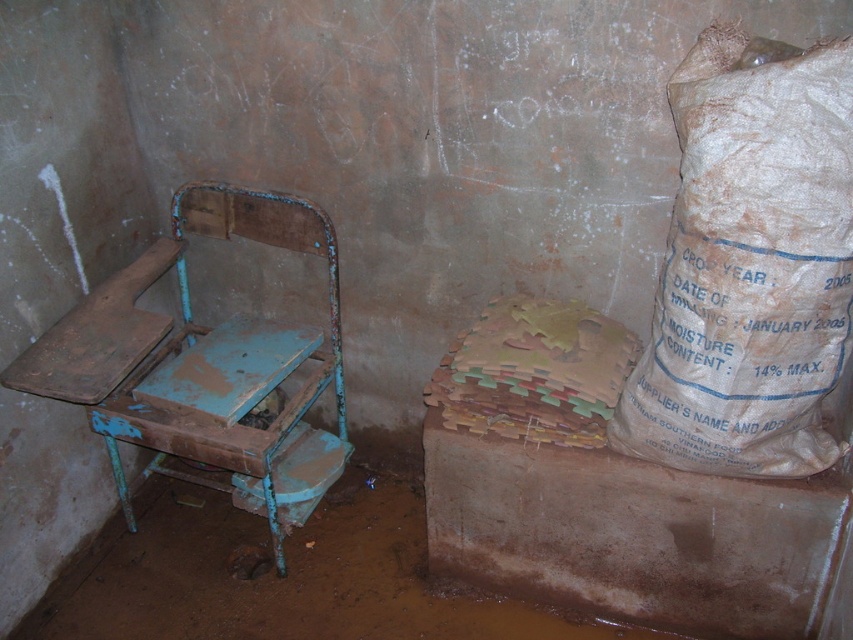
You are standing in the room and want to place a new rug on the floor. The rug is 1 meter wide. The path between the brown paper sack at upper right and the rusty metal chair at left is 1.2 meters. Can the rug fit in that path?

The path between the brown paper sack at upper right and the rusty metal chair at left is 1.2 meters wide. Since the rug is 1 meter wide, it can fit in that path because 1 meter is narrower than 1.2 meters.